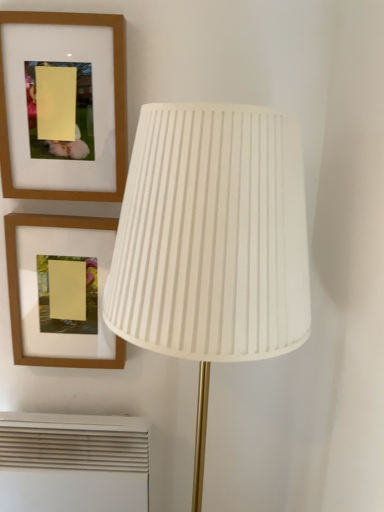
Locate an element on the screen. Image resolution: width=384 pixels, height=512 pixels. white pleated fabric lampshade at center is located at coordinates (212, 242).

Find the location of a particular element. This screenshot has width=384, height=512. white plastic air conditioner at lower left is located at coordinates (73, 463).

What do you see at coordinates (73, 463) in the screenshot? The image size is (384, 512). I see `white plastic air conditioner at lower left` at bounding box center [73, 463].

The width and height of the screenshot is (384, 512). Describe the element at coordinates (114, 101) in the screenshot. I see `wooden frame at upper left, which ranks as the second picture frame in bottom-to-top order` at that location.

The height and width of the screenshot is (512, 384). Find the location of `white pleated fabric lampshade at center`. white pleated fabric lampshade at center is located at coordinates (212, 242).

Is the position of white plastic air conditioner at lower left more distant than that of wooden picture frame at upper left, the first picture frame in the bottom-to-top sequence?

Yes, white plastic air conditioner at lower left is behind wooden picture frame at upper left, the first picture frame in the bottom-to-top sequence.

In the scene shown: Which point is more forward, (x=141, y=457) or (x=14, y=272)?

The point (x=14, y=272) is more forward.

The width and height of the screenshot is (384, 512). What are the coordinates of `air conditioner that appears behind the wooden picture frame at upper left, the first picture frame in the bottom-to-top sequence` in the screenshot? It's located at (73, 463).

From a real-world perspective, between white plastic air conditioner at lower left and wooden picture frame at upper left, arranged as the second picture frame when viewed from the top, who is vertically higher?

wooden picture frame at upper left, arranged as the second picture frame when viewed from the top.

Which object is closer to the camera, white pleated fabric lampshade at center or wooden picture frame at upper left, arranged as the second picture frame when viewed from the top?

Positioned in front is white pleated fabric lampshade at center.

Looking at this image, between white pleated fabric lampshade at center and wooden picture frame at upper left, arranged as the second picture frame when viewed from the top, which one appears on the right side from the viewer's perspective?

white pleated fabric lampshade at center is more to the right.

Considering the points (198, 163) and (118, 349), which point is in front, point (198, 163) or point (118, 349)?

The point (198, 163) is closer.

The width and height of the screenshot is (384, 512). What are the coordinates of `picture frame that is the 2nd one when counting rightward from the white plastic air conditioner at lower left` in the screenshot? It's located at (114, 101).

Is wooden frame at upper left, the first picture frame when ordered from top to bottom, oriented away from white plastic air conditioner at lower left?

No, white plastic air conditioner at lower left is not at the back of wooden frame at upper left, the first picture frame when ordered from top to bottom.

How different are the orientations of wooden frame at upper left, which ranks as the second picture frame in bottom-to-top order, and white plastic air conditioner at lower left in degrees?

0.00135 degrees.

Can we say wooden picture frame at upper left, arranged as the second picture frame when viewed from the top, lies outside wooden frame at upper left, which ranks as the second picture frame in bottom-to-top order?

wooden picture frame at upper left, arranged as the second picture frame when viewed from the top, is positioned outside wooden frame at upper left, which ranks as the second picture frame in bottom-to-top order.

At what (x,y) coordinates should I click in order to perform the action: click on picture frame lying in front of the wooden picture frame at upper left, arranged as the second picture frame when viewed from the top. Please return your answer as a coordinate pair (x, y). This screenshot has height=512, width=384. Looking at the image, I should click on (114, 101).

Is wooden frame at upper left, the first picture frame when ordered from top to bottom, at the back of wooden picture frame at upper left, arranged as the second picture frame when viewed from the top?

No, wooden picture frame at upper left, arranged as the second picture frame when viewed from the top, is not facing away from wooden frame at upper left, the first picture frame when ordered from top to bottom.

From the image's perspective, is wooden picture frame at upper left, the first picture frame in the bottom-to-top sequence, on wooden frame at upper left, the first picture frame when ordered from top to bottom?

Actually, wooden picture frame at upper left, the first picture frame in the bottom-to-top sequence, appears below wooden frame at upper left, the first picture frame when ordered from top to bottom, in the image.

Identify the location of lamp that is under the wooden frame at upper left, which ranks as the second picture frame in bottom-to-top order (from a real-world perspective). (212, 242).

Between white pleated fabric lampshade at center and wooden frame at upper left, which ranks as the second picture frame in bottom-to-top order, which one has less height?

wooden frame at upper left, which ranks as the second picture frame in bottom-to-top order.

Between white pleated fabric lampshade at center and wooden frame at upper left, which ranks as the second picture frame in bottom-to-top order, which one has larger size?

With larger size is white pleated fabric lampshade at center.

From the image's perspective, is white pleated fabric lampshade at center located above white plastic air conditioner at lower left?

Yes, from the image's perspective, white pleated fabric lampshade at center is over white plastic air conditioner at lower left.

Is white pleated fabric lampshade at center smaller than white plastic air conditioner at lower left?

Actually, white pleated fabric lampshade at center might be larger than white plastic air conditioner at lower left.

Between white pleated fabric lampshade at center and white plastic air conditioner at lower left, which one has larger width?

With larger width is white pleated fabric lampshade at center.

In the image, is wooden picture frame at upper left, the first picture frame in the bottom-to-top sequence, on the left side or the right side of white pleated fabric lampshade at center?

wooden picture frame at upper left, the first picture frame in the bottom-to-top sequence, is positioned on white pleated fabric lampshade at center's left side.

Looking at this image, from a real-world perspective, which is physically above, wooden picture frame at upper left, arranged as the second picture frame when viewed from the top, or white pleated fabric lampshade at center?

wooden picture frame at upper left, arranged as the second picture frame when viewed from the top, from a real-world perspective.

In the image, is wooden picture frame at upper left, the first picture frame in the bottom-to-top sequence, positioned in front of or behind white pleated fabric lampshade at center?

In the image, wooden picture frame at upper left, the first picture frame in the bottom-to-top sequence, appears behind white pleated fabric lampshade at center.

Can you confirm if wooden picture frame at upper left, the first picture frame in the bottom-to-top sequence, is bigger than white pleated fabric lampshade at center?

Actually, wooden picture frame at upper left, the first picture frame in the bottom-to-top sequence, might be smaller than white pleated fabric lampshade at center.

There is a white plastic air conditioner at lower left. Identify the location of the 1st picture frame above it (from a real-world perspective). (19, 296).

Image resolution: width=384 pixels, height=512 pixels. What are the coordinates of `lamp that appears below the wooden picture frame at upper left, the first picture frame in the bottom-to-top sequence (from the image's perspective)` in the screenshot? It's located at click(212, 242).

Based on their spatial positions, is wooden picture frame at upper left, arranged as the second picture frame when viewed from the top, or white pleated fabric lampshade at center further from wooden frame at upper left, which ranks as the second picture frame in bottom-to-top order?

The object further to wooden frame at upper left, which ranks as the second picture frame in bottom-to-top order, is white pleated fabric lampshade at center.

Based on their spatial positions, is white pleated fabric lampshade at center or wooden picture frame at upper left, arranged as the second picture frame when viewed from the top, further from white plastic air conditioner at lower left?

white pleated fabric lampshade at center is further to white plastic air conditioner at lower left.

When comparing their distances from wooden picture frame at upper left, the first picture frame in the bottom-to-top sequence, does white pleated fabric lampshade at center or white plastic air conditioner at lower left seem closer?

The object closer to wooden picture frame at upper left, the first picture frame in the bottom-to-top sequence, is white plastic air conditioner at lower left.

Considering their positions, is wooden frame at upper left, which ranks as the second picture frame in bottom-to-top order, positioned closer to white plastic air conditioner at lower left than white pleated fabric lampshade at center?

Based on the image, white pleated fabric lampshade at center appears to be nearer to white plastic air conditioner at lower left.

Based on their spatial positions, is white plastic air conditioner at lower left or white pleated fabric lampshade at center further from wooden frame at upper left, which ranks as the second picture frame in bottom-to-top order?

white plastic air conditioner at lower left.

Looking at this image, when comparing their distances from white pleated fabric lampshade at center, does wooden picture frame at upper left, arranged as the second picture frame when viewed from the top, or wooden frame at upper left, the first picture frame when ordered from top to bottom, seem closer?

wooden frame at upper left, the first picture frame when ordered from top to bottom, is positioned closer to the anchor white pleated fabric lampshade at center.

Which object lies further to the anchor point white pleated fabric lampshade at center, white plastic air conditioner at lower left or wooden picture frame at upper left, the first picture frame in the bottom-to-top sequence?

white plastic air conditioner at lower left is positioned further to the anchor white pleated fabric lampshade at center.

When comparing their distances from white pleated fabric lampshade at center, does white plastic air conditioner at lower left or wooden frame at upper left, the first picture frame when ordered from top to bottom, seem closer?

wooden frame at upper left, the first picture frame when ordered from top to bottom, lies closer to white pleated fabric lampshade at center than the other object.

Locate an element on the screen. This screenshot has width=384, height=512. picture frame that lies between wooden frame at upper left, the first picture frame when ordered from top to bottom, and white plastic air conditioner at lower left from top to bottom is located at coordinates (19, 296).

This screenshot has width=384, height=512. I want to click on picture frame between wooden frame at upper left, the first picture frame when ordered from top to bottom, and white pleated fabric lampshade at center from top to bottom, so 19,296.

Where is `lamp between wooden frame at upper left, which ranks as the second picture frame in bottom-to-top order, and white plastic air conditioner at lower left from top to bottom`? Image resolution: width=384 pixels, height=512 pixels. lamp between wooden frame at upper left, which ranks as the second picture frame in bottom-to-top order, and white plastic air conditioner at lower left from top to bottom is located at coordinates (212, 242).